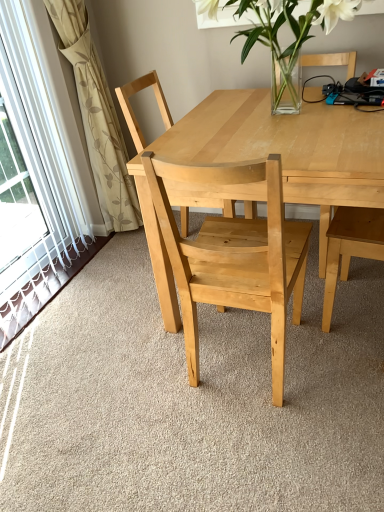
Question: Is natural wood table at center with beige floral fabric at left?

Choices:
 (A) no
 (B) yes

Answer: (A)

Question: Is natural wood table at center not within beige floral fabric at left?

Choices:
 (A) yes
 (B) no

Answer: (A)

Question: From a real-world perspective, is natural wood table at center under beige floral fabric at left?

Choices:
 (A) no
 (B) yes

Answer: (B)

Question: Does natural wood table at center have a larger size compared to beige floral fabric at left?

Choices:
 (A) yes
 (B) no

Answer: (A)

Question: Considering the relative sizes of natural wood table at center and beige floral fabric at left in the image provided, is natural wood table at center taller than beige floral fabric at left?

Choices:
 (A) no
 (B) yes

Answer: (A)

Question: Considering the relative positions of natural wood table at center and natural wood chair at center, the 1th chair viewed from the front, in the image provided, is natural wood table at center to the left or to the right of natural wood chair at center, the 1th chair viewed from the front,?

Choices:
 (A) left
 (B) right

Answer: (B)

Question: From the image's perspective, is natural wood table at center positioned above or below natural wood chair at center, marked as the second chair in a back-to-front arrangement?

Choices:
 (A) below
 (B) above

Answer: (B)

Question: Is natural wood table at center wider or thinner than natural wood chair at center, the 1th chair viewed from the front?

Choices:
 (A) wide
 (B) thin

Answer: (A)

Question: From a real-world perspective, is natural wood table at center positioned above or below natural wood chair at center, the 1th chair viewed from the front?

Choices:
 (A) below
 (B) above

Answer: (A)

Question: Is clear glass vase at upper center taller or shorter than natural wood chair at center, the 1th chair viewed from the front?

Choices:
 (A) tall
 (B) short

Answer: (B)

Question: Based on their sizes in the image, would you say clear glass vase at upper center is bigger or smaller than natural wood chair at center, the 1th chair viewed from the front?

Choices:
 (A) small
 (B) big

Answer: (A)

Question: Considering the positions of point (264, 23) and point (231, 173), is point (264, 23) closer or farther from the camera than point (231, 173)?

Choices:
 (A) farther
 (B) closer

Answer: (A)

Question: Is clear glass vase at upper center wider or thinner than natural wood chair at center, the 1th chair viewed from the front?

Choices:
 (A) wide
 (B) thin

Answer: (A)

Question: Is beige floral fabric at left situated inside clear glass vase at upper center or outside?

Choices:
 (A) inside
 (B) outside

Answer: (B)

Question: Considering the positions of point (71, 64) and point (249, 38), is point (71, 64) closer or farther from the camera than point (249, 38)?

Choices:
 (A) farther
 (B) closer

Answer: (A)